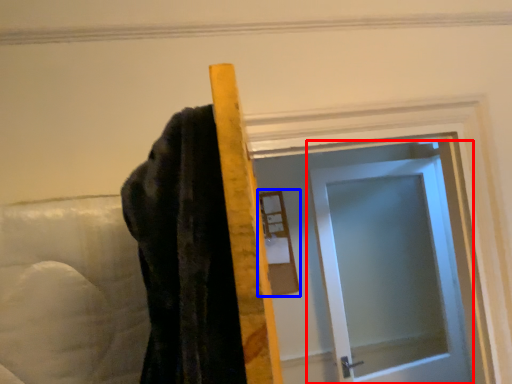
Question: Among these objects, which one is nearest to the camera, door (highlighted by a red box) or mirror (highlighted by a blue box)?

Choices:
 (A) door
 (B) mirror

Answer: (A)